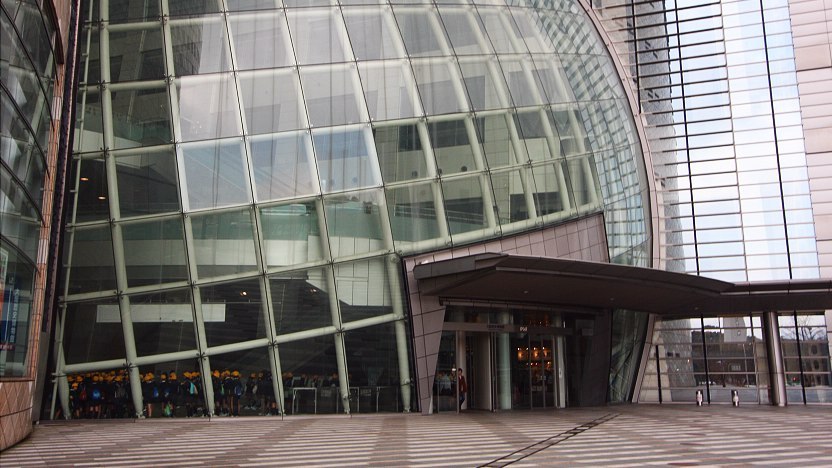
Find the location of `white hvac stuff`. white hvac stuff is located at coordinates (359, 281).